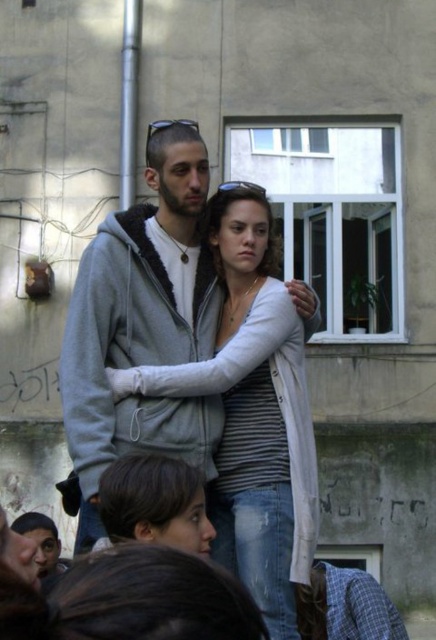
Is striped knit sweater at center behind gray fleece sweatshirt at center?

No, it is in front of gray fleece sweatshirt at center.

Can you confirm if striped knit sweater at center is taller than gray fleece sweatshirt at center?

Yes, striped knit sweater at center is taller than gray fleece sweatshirt at center.

Where is `striped knit sweater at center`? striped knit sweater at center is located at coordinates (252, 412).